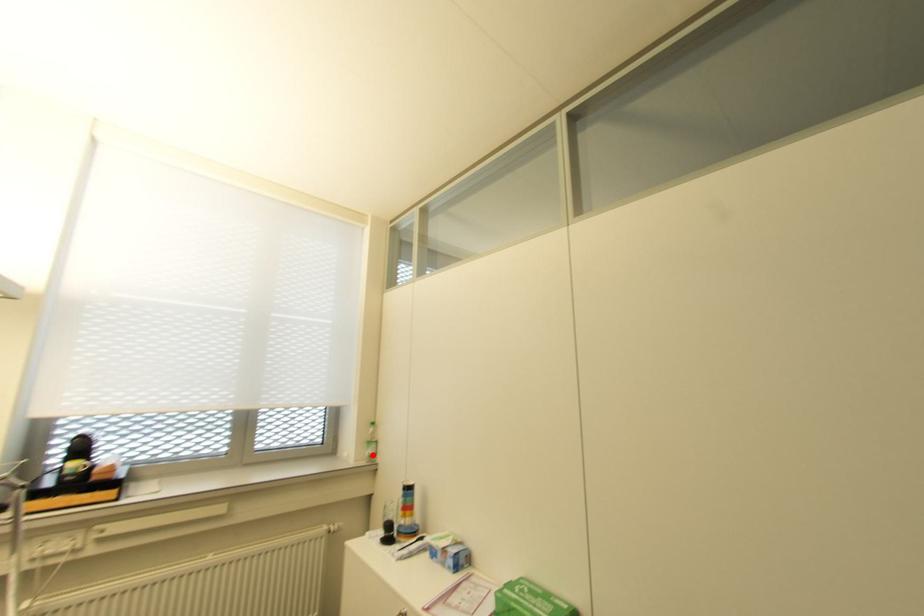
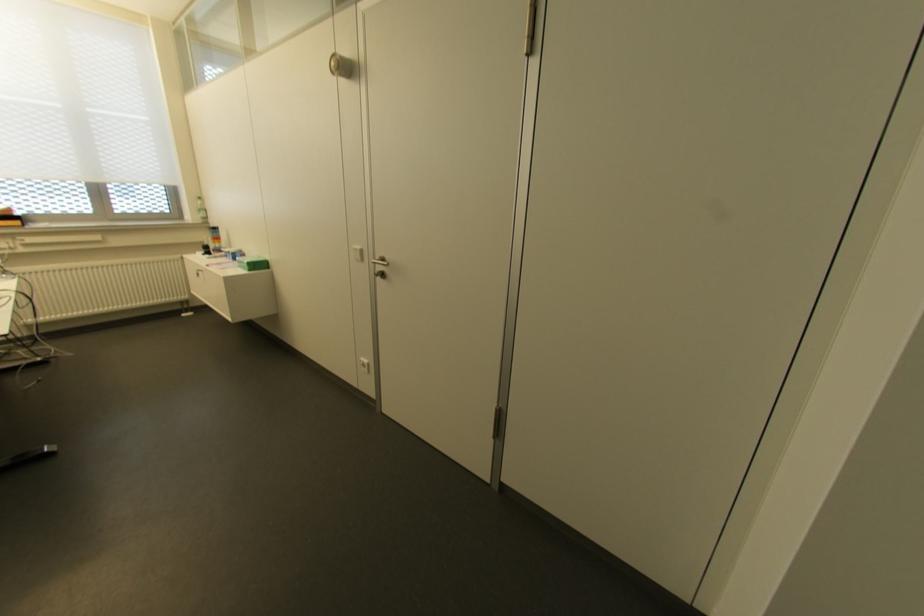
Question: I am providing you with two images of the same scene from different viewpoints. In image1, a red point is highlighted. Considering the same 3D point in image2, which of the following is correct?

Choices:
 (A) It is closer
 (B) It is farther

Answer: (A)